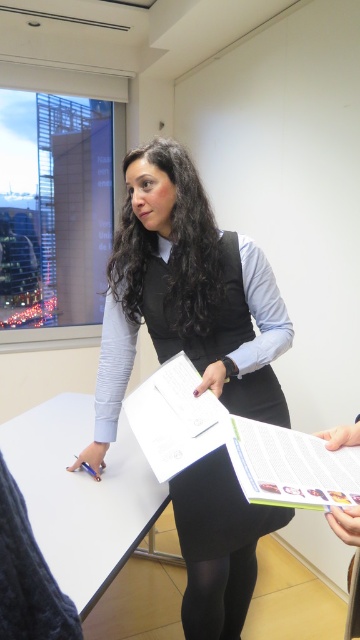
Question: Among these points, which one is farthest from the camera?

Choices:
 (A) (92, 596)
 (B) (149, 294)

Answer: (B)

Question: Is matte black vest at center above white matte table at center?

Choices:
 (A) yes
 (B) no

Answer: (A)

Question: Is matte black vest at center smaller than white matte table at center?

Choices:
 (A) no
 (B) yes

Answer: (A)

Question: Which of the following is the farthest from the observer?

Choices:
 (A) matte black vest at center
 (B) white matte table at center

Answer: (A)

Question: Is matte black vest at center to the right of white matte table at center from the viewer's perspective?

Choices:
 (A) yes
 (B) no

Answer: (A)

Question: Among these objects, which one is farthest from the camera?

Choices:
 (A) white matte table at center
 (B) matte black vest at center

Answer: (B)